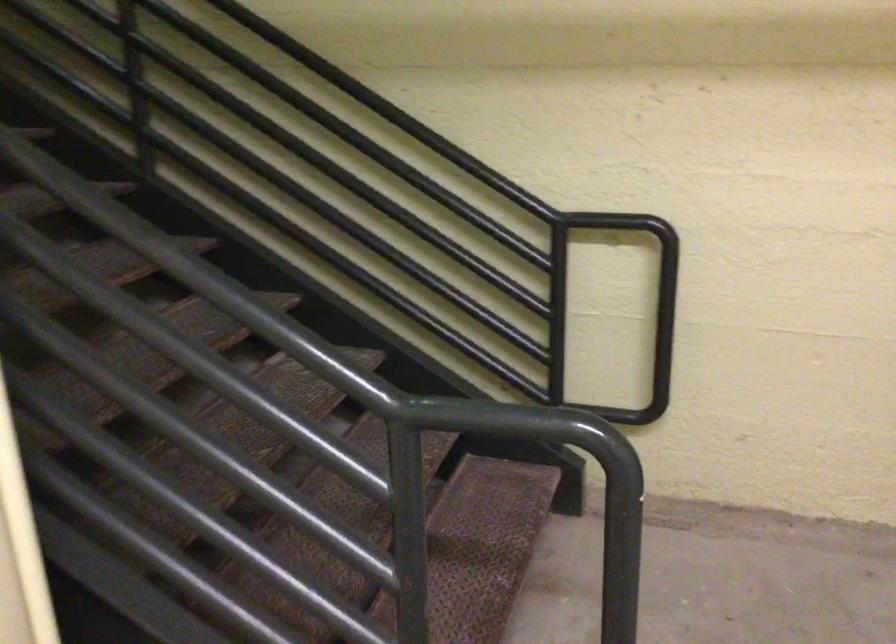
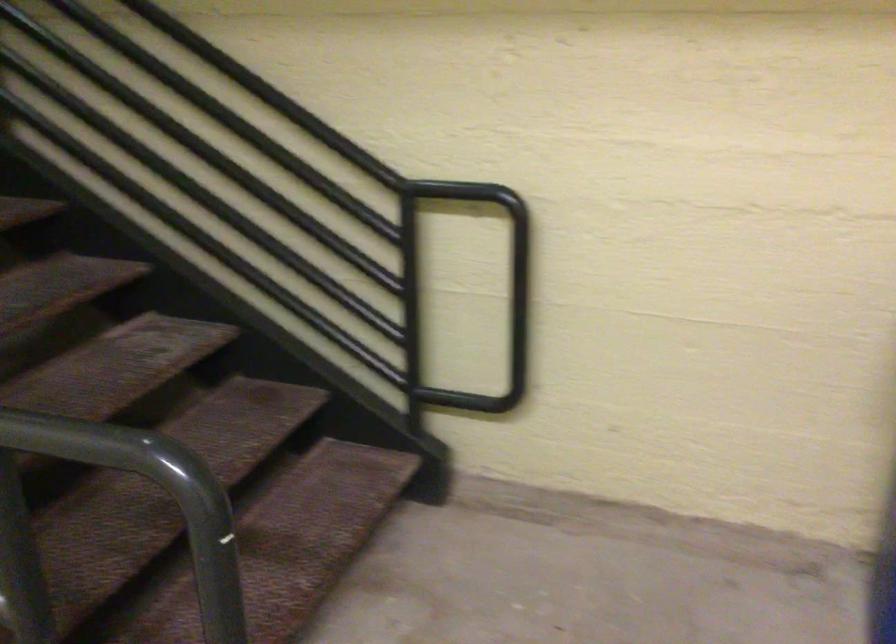
Question: How did the camera likely rotate?

Choices:
 (A) Left
 (B) Right
 (C) Up
 (D) Down

Answer: (B)